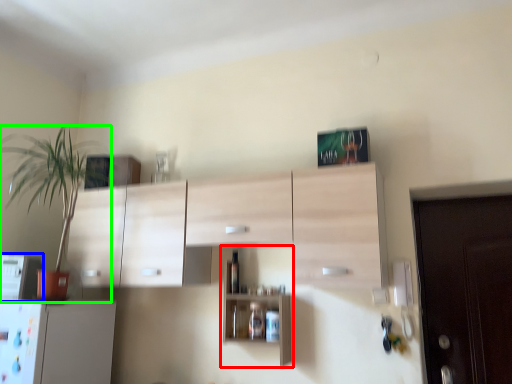
Question: Which object is positioned closest to shelf (highlighted by a red box)? Select from appliance (highlighted by a blue box) and houseplant (highlighted by a green box).

Choices:
 (A) appliance
 (B) houseplant

Answer: (A)